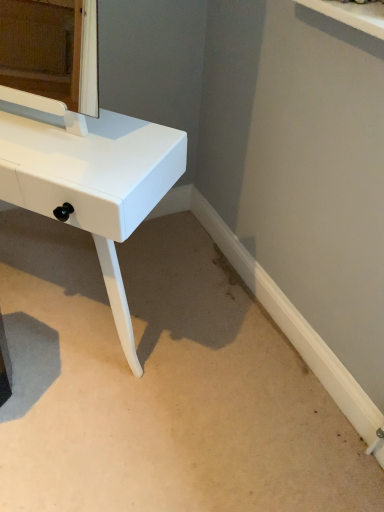
The height and width of the screenshot is (512, 384). Find the location of `empty space that is to the right of white glossy desk at upper left`. empty space that is to the right of white glossy desk at upper left is located at coordinates tap(218, 359).